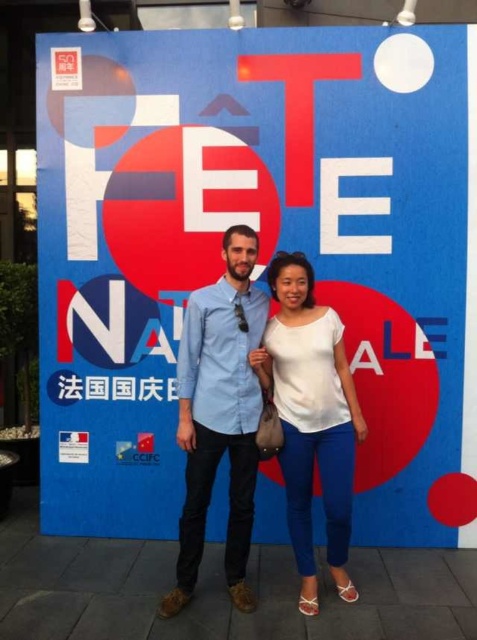
Can you confirm if blue denim shirt at center is positioned below white matte shirt at center?

No.

Between blue denim shirt at center and white matte shirt at center, which one appears on the right side from the viewer's perspective?

white matte shirt at center

Identify the location of blue denim shirt at center. (219, 413).